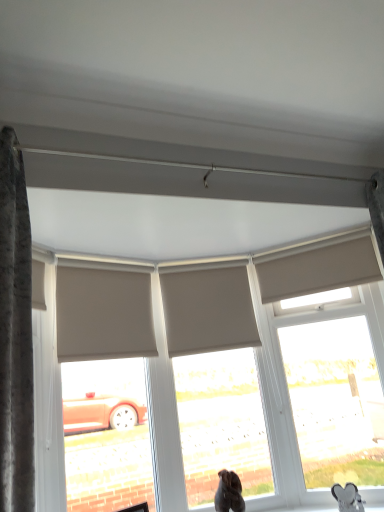
The width and height of the screenshot is (384, 512). Describe the element at coordinates (103, 314) in the screenshot. I see `beige fabric roller blind at upper left, which is counted as the 3th shutter, starting from the right` at that location.

This screenshot has height=512, width=384. What do you see at coordinates (208, 310) in the screenshot?
I see `beige fabric shutter at center, arranged as the 2th shutter when viewed from the right` at bounding box center [208, 310].

Consider the image. In order to face beige fabric shutter at center, arranged as the 2th shutter when viewed from the right, should I rotate leftwards or rightwards?

Turn right approximately 2.270 degrees to face it.

What do you see at coordinates (335, 401) in the screenshot? This screenshot has width=384, height=512. I see `matte beige window at upper right, which is the 1th window from right to left` at bounding box center [335, 401].

What is the approximate height of matte gray window at center, which appears as the 2th window when viewed from the right?

The height of matte gray window at center, which appears as the 2th window when viewed from the right, is 4.58 feet.

The width and height of the screenshot is (384, 512). In order to click on brown fur dog at lower center in this screenshot , I will do pyautogui.click(x=229, y=493).

Is beige fabric shutter at center, which is the second shutter from left to right, to the left or to the right of matte beige window at upper right, the 2th window in the left-to-right sequence, in the image?

beige fabric shutter at center, which is the second shutter from left to right, is positioned on matte beige window at upper right, the 2th window in the left-to-right sequence,'s left side.

From the image's perspective, count 1st windows downward from the beige fabric shutter at center, arranged as the 2th shutter when viewed from the right, and point to it. Please provide its 2D coordinates.

[(335, 401)]

What's the angular difference between beige fabric shutter at center, arranged as the 2th shutter when viewed from the right, and matte beige window at upper right, the 2th window in the left-to-right sequence,'s facing directions?

beige fabric shutter at center, arranged as the 2th shutter when viewed from the right, and matte beige window at upper right, the 2th window in the left-to-right sequence, are facing 29.2 degrees away from each other.

From a real-world perspective, is beige fabric shutter at center, arranged as the 2th shutter when viewed from the right, above or below matte beige window at upper right, which is the 1th window from right to left?

In terms of real-world spatial position, beige fabric shutter at center, arranged as the 2th shutter when viewed from the right, is above matte beige window at upper right, which is the 1th window from right to left.

Which of these two, metallic silver heart-shaped object at lower right or matte gray window at center, placed as the 1th window when sorted from left to right, is bigger?

With larger size is matte gray window at center, placed as the 1th window when sorted from left to right.

I want to click on animal in front of the matte gray window at center, placed as the 1th window when sorted from left to right, so click(348, 497).

Considering the positions of point (359, 496) and point (219, 395), is point (359, 496) closer or farther from the camera than point (219, 395)?

Point (359, 496) is closer to the camera than point (219, 395).

Who is shorter, metallic silver heart-shaped object at lower right or matte gray window at center, which appears as the 2th window when viewed from the right?

metallic silver heart-shaped object at lower right is shorter.

Based on the photo, from the image's perspective, is matte gray window at center, placed as the 1th window when sorted from left to right, under beige fabric shutter at upper center, which is the 1th shutter in right-to-left order?

Yes.

Considering the sizes of objects matte gray window at center, which appears as the 2th window when viewed from the right, and beige fabric shutter at upper center, which is the 1th shutter in right-to-left order, in the image provided, who is shorter, matte gray window at center, which appears as the 2th window when viewed from the right, or beige fabric shutter at upper center, which is the 1th shutter in right-to-left order,?

beige fabric shutter at upper center, which is the 1th shutter in right-to-left order, is shorter.

How much distance is there between matte gray window at center, placed as the 1th window when sorted from left to right, and beige fabric shutter at upper center, which is the 1th shutter in right-to-left order?

27.32 inches.

Starting from the matte gray window at center, placed as the 1th window when sorted from left to right, which shutter is the 1st one behind? Please provide its 2D coordinates.

[(318, 270)]

Which object is wider, matte gray window at center, placed as the 1th window when sorted from left to right, or beige fabric shutter at center, arranged as the 2th shutter when viewed from the right?

Wider between the two is matte gray window at center, placed as the 1th window when sorted from left to right.

Based on the photo, is matte gray window at center, which appears as the 2th window when viewed from the right, not close to beige fabric shutter at center, which is the second shutter from left to right?

matte gray window at center, which appears as the 2th window when viewed from the right, is near beige fabric shutter at center, which is the second shutter from left to right, not far away.

From the matte gray window at center, placed as the 1th window when sorted from left to right, count the 1st shutter to the left and point to it. Please provide its 2D coordinates.

[(208, 310)]

Considering the relative sizes of beige fabric shutter at center, arranged as the 2th shutter when viewed from the right, and beige fabric roller blind at upper left, arranged as the first shutter when viewed from the left, in the image provided, is beige fabric shutter at center, arranged as the 2th shutter when viewed from the right, wider than beige fabric roller blind at upper left, arranged as the first shutter when viewed from the left,?

No.

Consider the image. From the image's perspective, which object appears higher, beige fabric shutter at center, arranged as the 2th shutter when viewed from the right, or beige fabric roller blind at upper left, arranged as the first shutter when viewed from the left?

beige fabric roller blind at upper left, arranged as the first shutter when viewed from the left, is shown above in the image.

Based on their sizes in the image, would you say beige fabric shutter at center, which is the second shutter from left to right, is bigger or smaller than beige fabric roller blind at upper left, which is counted as the 3th shutter, starting from the right?

In the image, beige fabric shutter at center, which is the second shutter from left to right, appears to be smaller than beige fabric roller blind at upper left, which is counted as the 3th shutter, starting from the right.

Identify the location of the 1st window in front of the beige fabric shutter at upper center, the 3th shutter in the left-to-right sequence. The image size is (384, 512). (221, 423).

Considering the sizes of beige fabric shutter at upper center, the 3th shutter in the left-to-right sequence, and matte gray window at center, which appears as the 2th window when viewed from the right, in the image, is beige fabric shutter at upper center, the 3th shutter in the left-to-right sequence, taller or shorter than matte gray window at center, which appears as the 2th window when viewed from the right,?

Clearly, beige fabric shutter at upper center, the 3th shutter in the left-to-right sequence, is shorter compared to matte gray window at center, which appears as the 2th window when viewed from the right.

Would you consider beige fabric shutter at upper center, which is the 1th shutter in right-to-left order, to be distant from matte gray window at center, placed as the 1th window when sorted from left to right?

beige fabric shutter at upper center, which is the 1th shutter in right-to-left order, is actually quite close to matte gray window at center, placed as the 1th window when sorted from left to right.

Which of these two, beige fabric shutter at upper center, the 3th shutter in the left-to-right sequence, or matte gray window at center, which appears as the 2th window when viewed from the right, is smaller?

With smaller size is beige fabric shutter at upper center, the 3th shutter in the left-to-right sequence.

From a real-world perspective, is beige fabric roller blind at upper left, arranged as the first shutter when viewed from the left, beneath matte beige window at upper right, which is the 1th window from right to left?

No.

Is beige fabric roller blind at upper left, which is counted as the 3th shutter, starting from the right, to the left of matte beige window at upper right, which is the 1th window from right to left, from the viewer's perspective?

Yes, beige fabric roller blind at upper left, which is counted as the 3th shutter, starting from the right, is to the left of matte beige window at upper right, which is the 1th window from right to left.

Would you say beige fabric roller blind at upper left, which is counted as the 3th shutter, starting from the right, contains matte beige window at upper right, which is the 1th window from right to left?

That's incorrect, matte beige window at upper right, which is the 1th window from right to left, is not inside beige fabric roller blind at upper left, which is counted as the 3th shutter, starting from the right.

Which of these two, beige fabric roller blind at upper left, which is counted as the 3th shutter, starting from the right, or matte beige window at upper right, which is the 1th window from right to left, stands taller?

matte beige window at upper right, which is the 1th window from right to left, is taller.

Starting from the beige fabric shutter at center, arranged as the 2th shutter when viewed from the right, which window is the 2nd one to the right? Please provide its 2D coordinates.

[(335, 401)]

From a real-world perspective, starting from the metallic silver heart-shaped object at lower right, which window is the 2nd one vertically above it? Please provide its 2D coordinates.

[(221, 423)]

When comparing their distances from brown fur dog at lower center, does matte gray window at center, which appears as the 2th window when viewed from the right, or beige fabric roller blind at upper left, which is counted as the 3th shutter, starting from the right, seem closer?

The object closer to brown fur dog at lower center is matte gray window at center, which appears as the 2th window when viewed from the right.

Based on their spatial positions, is beige fabric shutter at upper center, the 3th shutter in the left-to-right sequence, or beige fabric roller blind at upper left, arranged as the first shutter when viewed from the left, further from brown fur dog at lower center?

Based on the image, beige fabric shutter at upper center, the 3th shutter in the left-to-right sequence, appears to be further to brown fur dog at lower center.

Based on their spatial positions, is metallic silver heart-shaped object at lower right or beige fabric shutter at center, which is the second shutter from left to right, closer to beige fabric roller blind at upper left, which is counted as the 3th shutter, starting from the right?

beige fabric shutter at center, which is the second shutter from left to right, lies closer to beige fabric roller blind at upper left, which is counted as the 3th shutter, starting from the right, than the other object.

Estimate the real-world distances between objects in this image. Which object is further from matte beige window at upper right, which is the 1th window from right to left, metallic silver heart-shaped object at lower right or beige fabric shutter at center, which is the second shutter from left to right?

Among the two, beige fabric shutter at center, which is the second shutter from left to right, is located further to matte beige window at upper right, which is the 1th window from right to left.

Considering their positions, is matte beige window at upper right, which is the 1th window from right to left, positioned closer to beige fabric shutter at center, which is the second shutter from left to right, than metallic silver heart-shaped object at lower right?

matte beige window at upper right, which is the 1th window from right to left, is closer to beige fabric shutter at center, which is the second shutter from left to right.

From the image, which object appears to be farther from beige fabric shutter at center, arranged as the 2th shutter when viewed from the right, matte beige window at upper right, the 2th window in the left-to-right sequence, or brown fur dog at lower center?

brown fur dog at lower center lies further to beige fabric shutter at center, arranged as the 2th shutter when viewed from the right, than the other object.

Which object lies further to the anchor point matte gray window at center, placed as the 1th window when sorted from left to right, matte beige window at upper right, the 2th window in the left-to-right sequence, or beige fabric shutter at upper center, which is the 1th shutter in right-to-left order?

Among the two, beige fabric shutter at upper center, which is the 1th shutter in right-to-left order, is located further to matte gray window at center, placed as the 1th window when sorted from left to right.

When comparing their distances from beige fabric shutter at upper center, which is the 1th shutter in right-to-left order, does beige fabric shutter at center, which is the second shutter from left to right, or metallic silver heart-shaped object at lower right seem closer?

beige fabric shutter at center, which is the second shutter from left to right, lies closer to beige fabric shutter at upper center, which is the 1th shutter in right-to-left order, than the other object.

The height and width of the screenshot is (512, 384). I want to click on shutter situated between beige fabric roller blind at upper left, which is counted as the 3th shutter, starting from the right, and beige fabric shutter at upper center, the 3th shutter in the left-to-right sequence, from left to right, so click(x=208, y=310).

Find the location of a particular element. dog situated between matte gray window at center, placed as the 1th window when sorted from left to right, and metallic silver heart-shaped object at lower right from left to right is located at coordinates (229, 493).

Where is `animal located between matte gray window at center, which appears as the 2th window when viewed from the right, and matte beige window at upper right, which is the 1th window from right to left, in the left-right direction`? animal located between matte gray window at center, which appears as the 2th window when viewed from the right, and matte beige window at upper right, which is the 1th window from right to left, in the left-right direction is located at coordinates (348, 497).

Find the location of a particular element. Image resolution: width=384 pixels, height=512 pixels. shutter between beige fabric shutter at center, which is the second shutter from left to right, and matte beige window at upper right, which is the 1th window from right to left, from left to right is located at coordinates (318, 270).